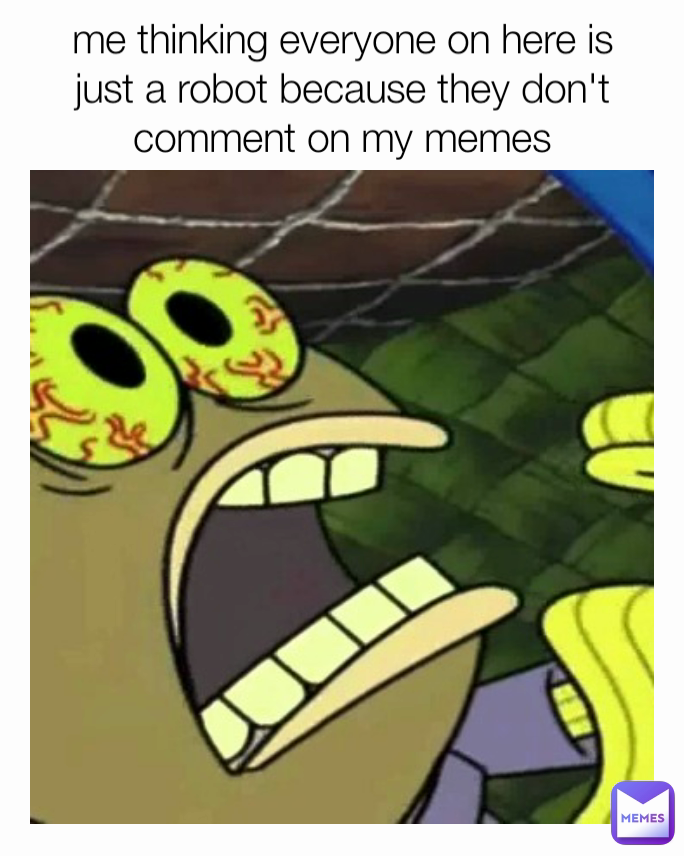
Identify the location of squares on ceiling. The height and width of the screenshot is (856, 684). (352, 245), (508, 241).